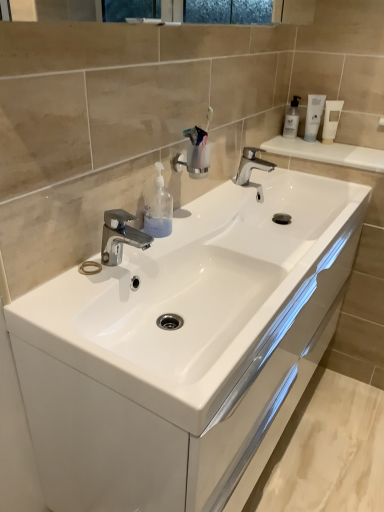
You are a GUI agent. You are given a task and a screenshot of the screen. Output one action in this format:
    pyautogui.click(x=<x>, y=<y>)
    Task: Click on the free spot in front of polished chrome faucet at center, which is counted as the 2th tap, starting from the right
    This screenshot has width=384, height=512.
    Given the screenshot: What is the action you would take?
    pyautogui.click(x=81, y=303)